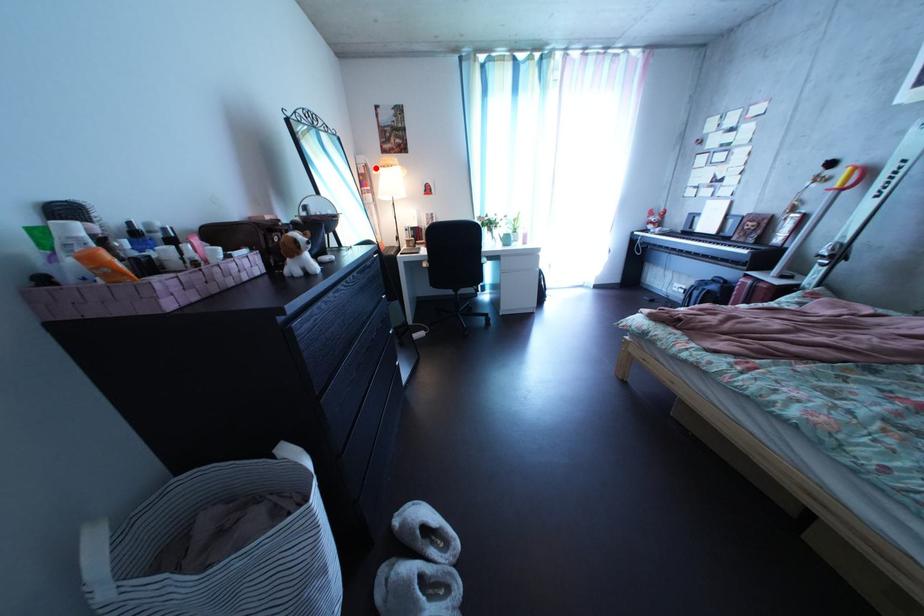
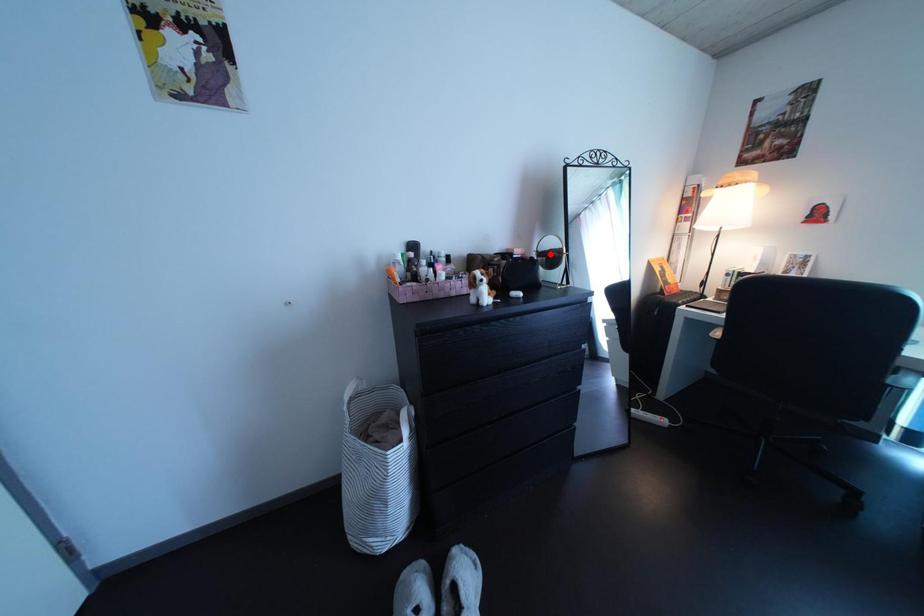
I am providing you with two images of the same scene from different viewpoints. A red point is marked on the first image and another point is marked on the second image. Is the red point in image1 aligned with the point shown in image2?

No